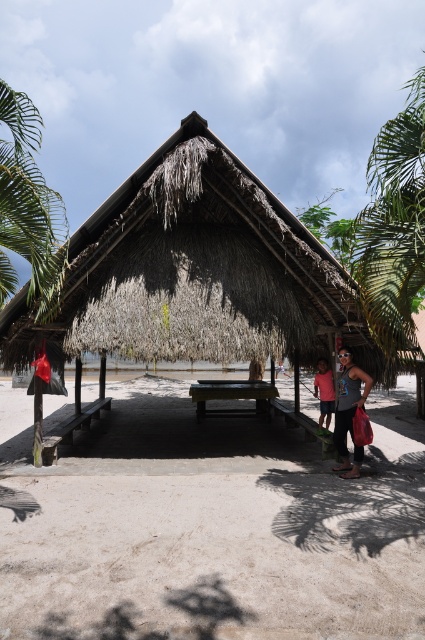
Question: Estimate the real-world distances between objects in this image. Which object is closer to the green leafy palm tree at left?

Choices:
 (A) smooth wooden picnic table at center
 (B) thatched roof hut at center

Answer: (B)

Question: Does smooth wooden picnic table at center have a lesser width compared to matte pink shirt at lower right?

Choices:
 (A) yes
 (B) no

Answer: (B)

Question: Estimate the real-world distances between objects in this image. Which object is closer to the light brown sandy beach at lower center?

Choices:
 (A) matte black sunglasses at lower right
 (B) green leafy palm tree at left
 (C) matte pink shirt at lower right
 (D) thatched roof hut at center

Answer: (A)

Question: Is thatched roof hut at center wider than smooth wooden picnic table at center?

Choices:
 (A) no
 (B) yes

Answer: (B)

Question: Can you confirm if green leafy palm tree at left is positioned above smooth wooden picnic table at center?

Choices:
 (A) no
 (B) yes

Answer: (B)

Question: Considering the real-world distances, which object is farthest from the matte black sunglasses at lower right?

Choices:
 (A) light brown sandy beach at lower center
 (B) smooth wooden picnic table at center

Answer: (B)